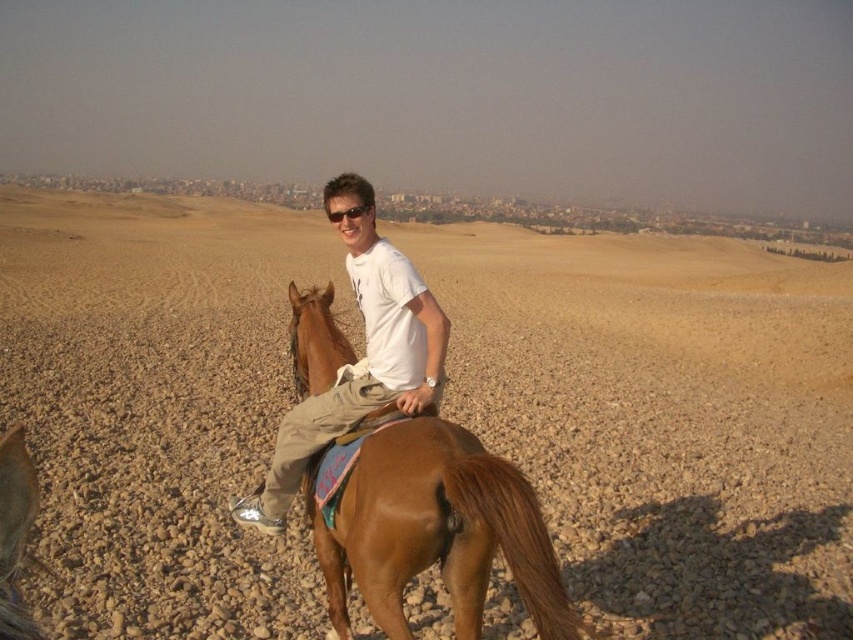
You are a photographer trying to capture the rider in the desert. You notice the matte white shirt at center and the black plastic sunglasses at center. Which object should you focus on to ensure the entire subject is in frame without cropping?

The matte white shirt at center is wider than the black plastic sunglasses at center, so focusing on the matte white shirt at center will ensure the entire subject is in frame without cropping.

Based on the photo, you are a photographer trying to capture the rider and horse in the desert. You notice the brown gravelly dirt field at center and the black plastic sunglasses at center. Which object is located above the other?

The brown gravelly dirt field at center is positioned over black plastic sunglasses at center, so the dirt field is above the sunglasses.